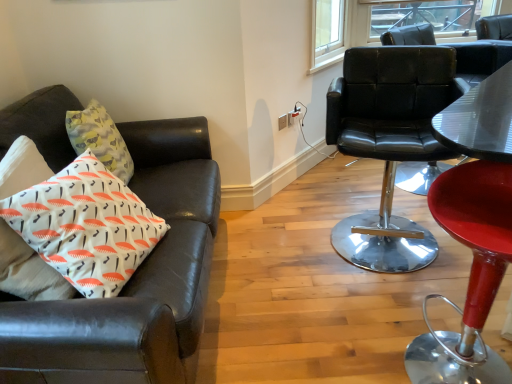
Question: Considering the relative sizes of clear glass window at upper right and leather couch at left, acting as the 1th chair starting from the left, in the image provided, is clear glass window at upper right shorter than leather couch at left, acting as the 1th chair starting from the left,?

Choices:
 (A) no
 (B) yes

Answer: (B)

Question: Considering the relative sizes of clear glass window at upper right and leather couch at left, acting as the 1th chair starting from the left, in the image provided, is clear glass window at upper right taller than leather couch at left, acting as the 1th chair starting from the left,?

Choices:
 (A) no
 (B) yes

Answer: (A)

Question: Could you tell me if clear glass window at upper right is facing leather couch at left, acting as the 1th chair starting from the left?

Choices:
 (A) no
 (B) yes

Answer: (A)

Question: From a real-world perspective, does clear glass window at upper right sit lower than leather couch at left, acting as the 1th chair starting from the left?

Choices:
 (A) no
 (B) yes

Answer: (A)

Question: Does clear glass window at upper right have a lesser width compared to leather couch at left, acting as the 1th chair starting from the left?

Choices:
 (A) yes
 (B) no

Answer: (A)

Question: Does point (282, 127) appear closer or farther from the camera than point (445, 49)?

Choices:
 (A) farther
 (B) closer

Answer: (A)

Question: Looking at the image, does white plastic power outlet at upper center seem bigger or smaller compared to black leather chair at right, marked as the 2th chair in a right-to-left arrangement?

Choices:
 (A) big
 (B) small

Answer: (B)

Question: Relative to black leather chair at right, which is the second chair in left-to-right order, is white plastic power outlet at upper center in front or behind?

Choices:
 (A) behind
 (B) front

Answer: (A)

Question: Would you say white plastic power outlet at upper center is inside or outside black leather chair at right, marked as the 2th chair in a right-to-left arrangement?

Choices:
 (A) outside
 (B) inside

Answer: (A)

Question: Would you say white printed cushion at left is inside or outside red leather bar stool at right, the first chair in the right-to-left sequence?

Choices:
 (A) outside
 (B) inside

Answer: (A)

Question: In the image, is white printed cushion at left positioned in front of or behind red leather bar stool at right, the first chair in the right-to-left sequence?

Choices:
 (A) front
 (B) behind

Answer: (B)

Question: Is point (x=38, y=223) closer or farther from the camera than point (x=493, y=370)?

Choices:
 (A) farther
 (B) closer

Answer: (B)

Question: From a real-world perspective, relative to red leather bar stool at right, which appears as the 3th chair when viewed from the left, is white printed cushion at left vertically above or below?

Choices:
 (A) below
 (B) above

Answer: (B)

Question: From a real-world perspective, is leather couch at left, arranged as the third chair when viewed from the right, physically located above or below red leather bar stool at right, the first chair in the right-to-left sequence?

Choices:
 (A) above
 (B) below

Answer: (A)

Question: In terms of height, does leather couch at left, acting as the 1th chair starting from the left, look taller or shorter compared to red leather bar stool at right, the first chair in the right-to-left sequence?

Choices:
 (A) short
 (B) tall

Answer: (B)